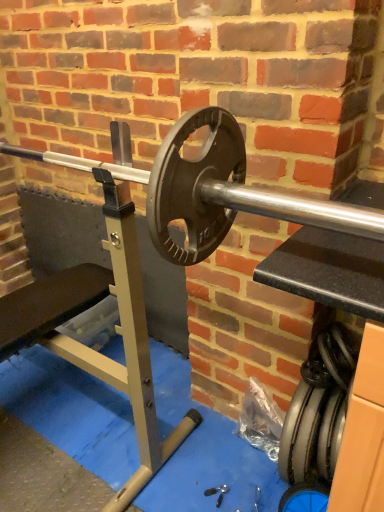
This screenshot has width=384, height=512. What do you see at coordinates (312, 433) in the screenshot?
I see `rubber/smooth tire at lower right` at bounding box center [312, 433].

Identify the location of rubber/smooth tire at lower right. (312, 433).

The width and height of the screenshot is (384, 512). What do you see at coordinates (208, 188) in the screenshot?
I see `polished silver barbell at center` at bounding box center [208, 188].

Where is `polished silver barbell at center`? polished silver barbell at center is located at coordinates (208, 188).

This screenshot has width=384, height=512. Identify the location of rubber/smooth tire at lower right. coord(312,433).

Does polished silver barbell at center appear on the right side of rubber/smooth tire at lower right?

No.

Which is in front, polished silver barbell at center or rubber/smooth tire at lower right?

Positioned in front is polished silver barbell at center.

Which is closer, [230,151] or [329,403]?

The point [230,151] is in front.

From the image's perspective, is polished silver barbell at center above rubber/smooth tire at lower right?

Correct, polished silver barbell at center appears higher than rubber/smooth tire at lower right in the image.

From a real-world perspective, is polished silver barbell at center under rubber/smooth tire at lower right?

Actually, polished silver barbell at center is physically above rubber/smooth tire at lower right in the real world.

Does polished silver barbell at center have a lesser width compared to rubber/smooth tire at lower right?

No.

Which of these two, polished silver barbell at center or rubber/smooth tire at lower right, stands taller?

rubber/smooth tire at lower right.

Between polished silver barbell at center and rubber/smooth tire at lower right, which one has smaller size?

With smaller size is rubber/smooth tire at lower right.

Is rubber/smooth tire at lower right a part of polished silver barbell at center?

No, rubber/smooth tire at lower right is not a part of polished silver barbell at center.

Would you say polished silver barbell at center is a long distance from rubber/smooth tire at lower right?

No, polished silver barbell at center is not far away from rubber/smooth tire at lower right.

Could you tell me if polished silver barbell at center is facing rubber/smooth tire at lower right?

No, polished silver barbell at center is not aimed at rubber/smooth tire at lower right.

Measure the distance between polished silver barbell at center and rubber/smooth tire at lower right.

27.41 inches.

I want to click on tire that is behind the polished silver barbell at center, so click(x=312, y=433).

Considering the positions of objects rubber/smooth tire at lower right and polished silver barbell at center in the image provided, who is more to the right, rubber/smooth tire at lower right or polished silver barbell at center?

From the viewer's perspective, rubber/smooth tire at lower right appears more on the right side.

Considering the positions of objects rubber/smooth tire at lower right and polished silver barbell at center in the image provided, who is in front, rubber/smooth tire at lower right or polished silver barbell at center?

polished silver barbell at center is more forward.

Which is more distant, [296,468] or [149,190]?

The point [296,468] is farther.

From the image's perspective, would you say rubber/smooth tire at lower right is shown under polished silver barbell at center?

Yes.

From a real-world perspective, which is physically above, rubber/smooth tire at lower right or polished silver barbell at center?

From a 3D spatial view, polished silver barbell at center is above.

Looking at their sizes, would you say rubber/smooth tire at lower right is wider or thinner than polished silver barbell at center?

rubber/smooth tire at lower right is thinner than polished silver barbell at center.

Considering the relative sizes of rubber/smooth tire at lower right and polished silver barbell at center in the image provided, is rubber/smooth tire at lower right taller than polished silver barbell at center?

Correct, rubber/smooth tire at lower right is much taller as polished silver barbell at center.

Who is smaller, rubber/smooth tire at lower right or polished silver barbell at center?

Smaller between the two is rubber/smooth tire at lower right.

Would you say rubber/smooth tire at lower right contains polished silver barbell at center?

That's incorrect, polished silver barbell at center is not inside rubber/smooth tire at lower right.

Is rubber/smooth tire at lower right beside polished silver barbell at center?

No, rubber/smooth tire at lower right is not next to polished silver barbell at center.

Is rubber/smooth tire at lower right facing away from polished silver barbell at center?

That's not correct — rubber/smooth tire at lower right is not looking away from polished silver barbell at center.

What's the angular difference between rubber/smooth tire at lower right and polished silver barbell at center's facing directions?

There is a 0.763-degree angle between the facing directions of rubber/smooth tire at lower right and polished silver barbell at center.

Locate an element on the screen. This screenshot has width=384, height=512. barbell located above the rubber/smooth tire at lower right (from the image's perspective) is located at coordinates (208, 188).

At what (x,y) coordinates should I click in order to perform the action: click on barbell above the rubber/smooth tire at lower right (from the image's perspective). Please return your answer as a coordinate pair (x, y). This screenshot has height=512, width=384. Looking at the image, I should click on (208, 188).

Where is `tire below the polished silver barbell at center (from the image's perspective)`? tire below the polished silver barbell at center (from the image's perspective) is located at coordinates (312, 433).